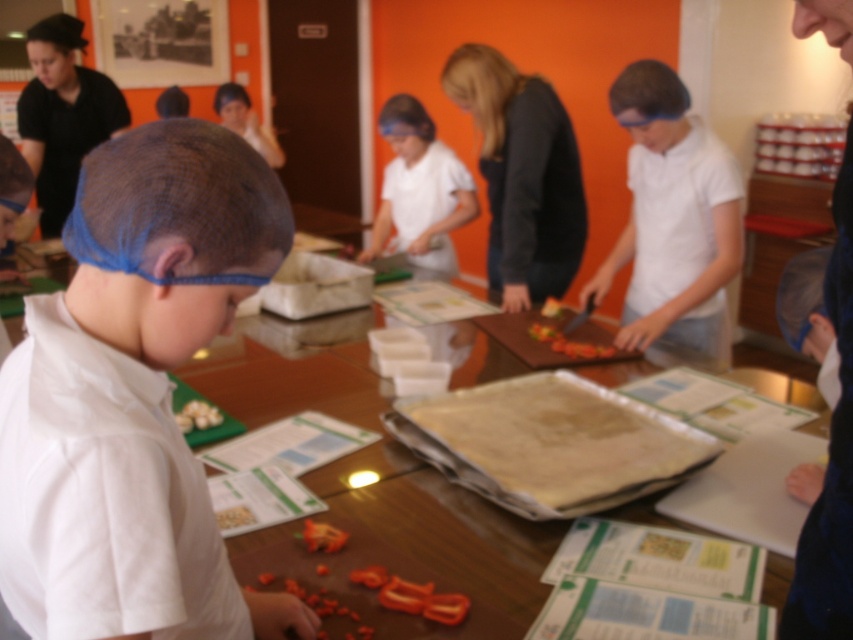
You are a photographer trying to capture the center of the white matte shirt at point (672, 218). What is the exact coordinate where you should focus your camera?

The exact coordinate to focus on is point (672, 218), as that is where the white matte shirt at center is located.